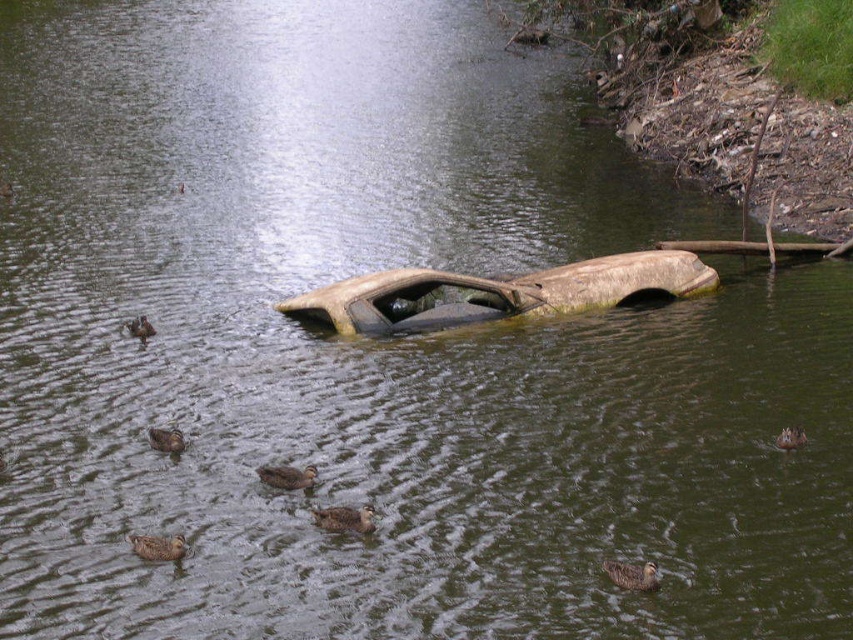
Question: Which object is closer to the camera taking this photo?

Choices:
 (A) brown fuzzy duck at lower right
 (B) brown matte duck at lower center

Answer: (B)

Question: Estimate the real-world distances between objects in this image. Which object is farther from the brown matte duck at upper left?

Choices:
 (A) brown fuzzy duck at lower right
 (B) brown matte duck at lower left
 (C) brown matte duck at lower center
 (D) brown fuzzy duck at center

Answer: (C)

Question: Observing the image, what is the correct spatial positioning of brown matte duck at lower center in reference to brown fuzzy duck at lower right?

Choices:
 (A) above
 (B) below

Answer: (B)

Question: Considering the real-world distances, which object is farthest from the brown fuzzy duck at lower right?

Choices:
 (A) brown matte duck at lower center
 (B) brown matte duck at center
 (C) brown fuzzy duck at lower left

Answer: (C)

Question: Can you confirm if brown fuzzy duck at lower right is smaller than brown matte duck at upper left?

Choices:
 (A) no
 (B) yes

Answer: (B)

Question: Is brown matte duck at center smaller than brown matte duck at upper left?

Choices:
 (A) no
 (B) yes

Answer: (B)